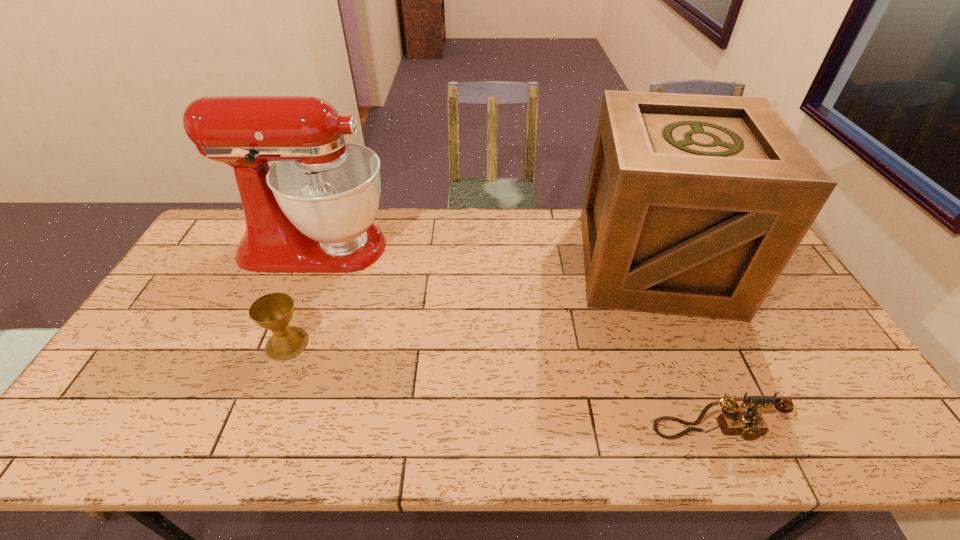
Where is `free space that satisfies the following two spatial constraints: 1. at the attachment hub of the mixer; 2. on the right side of the box`? free space that satisfies the following two spatial constraints: 1. at the attachment hub of the mixer; 2. on the right side of the box is located at coordinates (310, 262).

Locate an element on the screen. This screenshot has height=540, width=960. vacant position in the image that satisfies the following two spatial constraints: 1. at the attachment hub of the mixer; 2. on the left side of the third farthest object is located at coordinates (276, 343).

This screenshot has height=540, width=960. I want to click on free space that satisfies the following two spatial constraints: 1. at the attachment hub of the mixer; 2. on the right side of the box, so click(x=310, y=262).